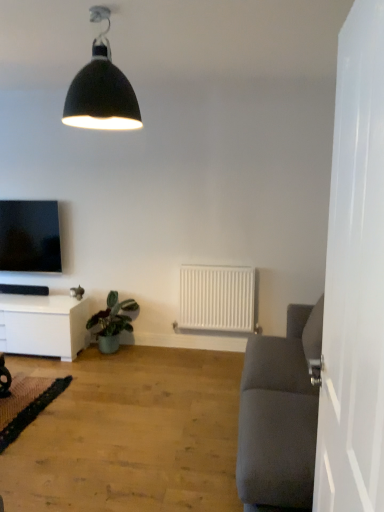
At what (x,y) coordinates should I click in order to perform the action: click on vacant space underneath black matte lampshade at upper center (from a real-world perspective). Please return your answer as a coordinate pair (x, y). This screenshot has height=512, width=384. Looking at the image, I should click on (104, 449).